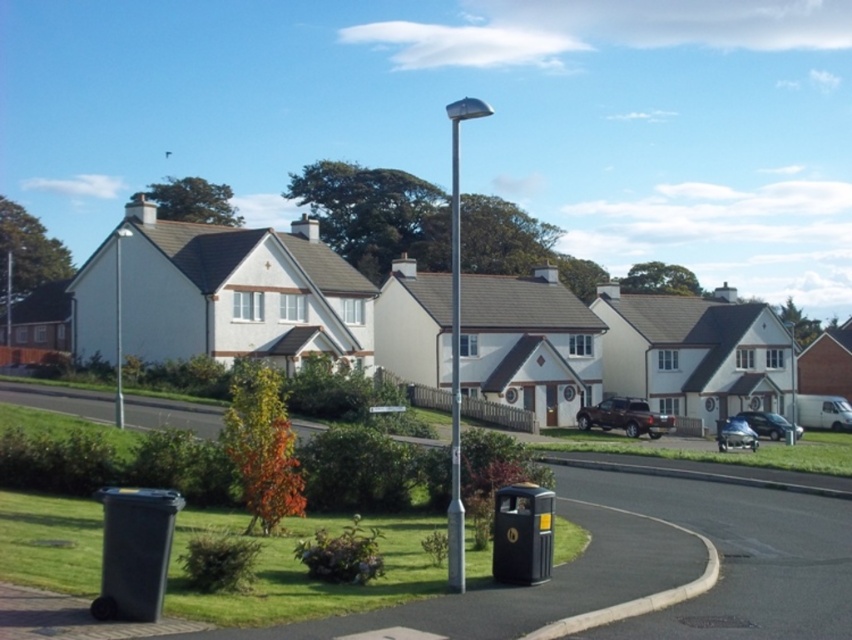
Question: Can you confirm if silver metallic pole at center is smaller than metallic silver pole at center?

Choices:
 (A) yes
 (B) no

Answer: (B)

Question: Which object is positioned farthest from the shiny silver car at center?

Choices:
 (A) brown matte truck at center
 (B) metallic silver pole at center
 (C) shiny blue sedan at right
 (D) silver metallic pole at center

Answer: (D)

Question: Which point appears closest to the camera in this image?

Choices:
 (A) (456, 536)
 (B) (456, 125)
 (C) (779, 419)
 (D) (738, 444)

Answer: (A)

Question: Is brown matte truck at center closer to the viewer compared to shiny silver car at center?

Choices:
 (A) yes
 (B) no

Answer: (B)

Question: Is silver metallic pole at center positioned in front of brown matte truck at center?

Choices:
 (A) yes
 (B) no

Answer: (A)

Question: Which point is closer to the camera?

Choices:
 (A) (462, 556)
 (B) (757, 433)
 (C) (609, 400)
 (D) (450, 563)

Answer: (A)